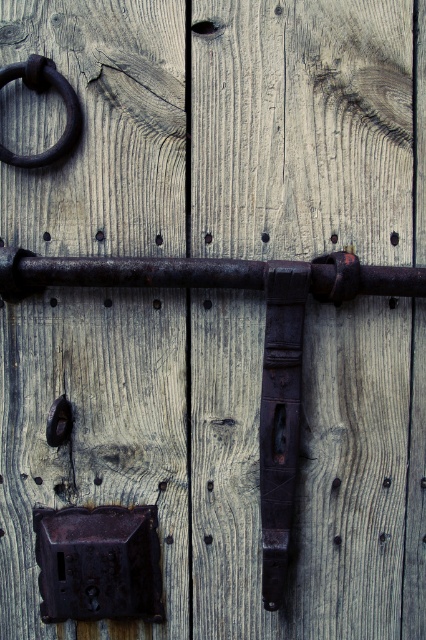
Question: Is rusty metal lock at lower left positioned behind rusty metal ring at upper left?

Choices:
 (A) no
 (B) yes

Answer: (B)

Question: Can you confirm if rusty metal lock at lower left is thinner than rusty metal ring at upper left?

Choices:
 (A) yes
 (B) no

Answer: (B)

Question: Which object appears farthest from the camera in this image?

Choices:
 (A) rusty metal lock at lower left
 (B) rusty metal ring at upper left

Answer: (A)

Question: Can you confirm if rusty metal lock at lower left is bigger than rusty metal ring at upper left?

Choices:
 (A) yes
 (B) no

Answer: (A)

Question: Which object appears closest to the camera in this image?

Choices:
 (A) rusty metal ring at upper left
 (B) rusty metal lock at lower left

Answer: (A)